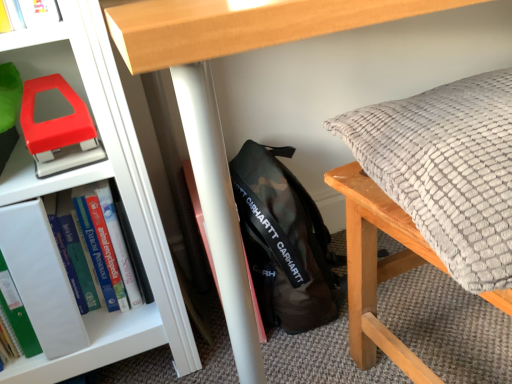
Question: Is textured gray pillow at right completely or partially inside matte plastic stapler at left?

Choices:
 (A) no
 (B) yes

Answer: (A)

Question: Is matte plastic stapler at left not inside textured gray pillow at right?

Choices:
 (A) yes
 (B) no

Answer: (A)

Question: Does matte plastic stapler at left have a smaller size compared to textured gray pillow at right?

Choices:
 (A) no
 (B) yes

Answer: (B)

Question: Can you confirm if matte plastic stapler at left is bigger than textured gray pillow at right?

Choices:
 (A) yes
 (B) no

Answer: (B)

Question: Does matte plastic stapler at left turn towards textured gray pillow at right?

Choices:
 (A) no
 (B) yes

Answer: (A)

Question: Can you confirm if matte plastic stapler at left is thinner than textured gray pillow at right?

Choices:
 (A) yes
 (B) no

Answer: (A)

Question: From a real-world perspective, is hardcover book at left over camo fabric backpack at center?

Choices:
 (A) yes
 (B) no

Answer: (A)

Question: Considering the relative sizes of hardcover book at left and camo fabric backpack at center in the image provided, is hardcover book at left shorter than camo fabric backpack at center?

Choices:
 (A) no
 (B) yes

Answer: (A)

Question: Is hardcover book at left smaller than camo fabric backpack at center?

Choices:
 (A) no
 (B) yes

Answer: (B)

Question: Can you confirm if hardcover book at left is thinner than camo fabric backpack at center?

Choices:
 (A) yes
 (B) no

Answer: (A)

Question: Does hardcover book at left have a larger size compared to camo fabric backpack at center?

Choices:
 (A) no
 (B) yes

Answer: (A)

Question: Is camo fabric backpack at center a part of hardcover book at left?

Choices:
 (A) yes
 (B) no

Answer: (B)

Question: Is textured gray pillow at right bigger than camo fabric backpack at center?

Choices:
 (A) yes
 (B) no

Answer: (A)